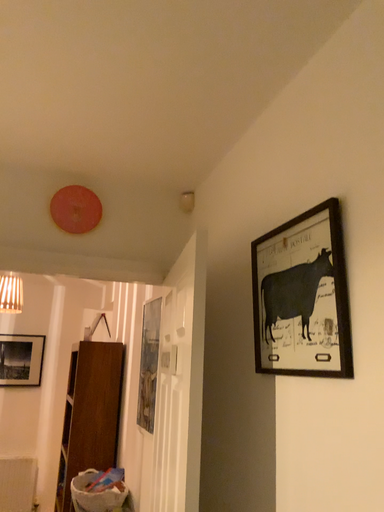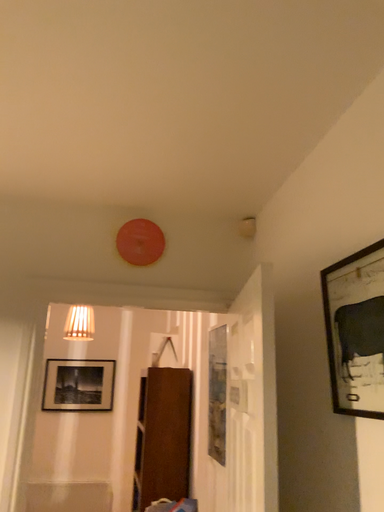
Question: How did the camera likely rotate when shooting the video?

Choices:
 (A) rotated right
 (B) rotated left

Answer: (B)